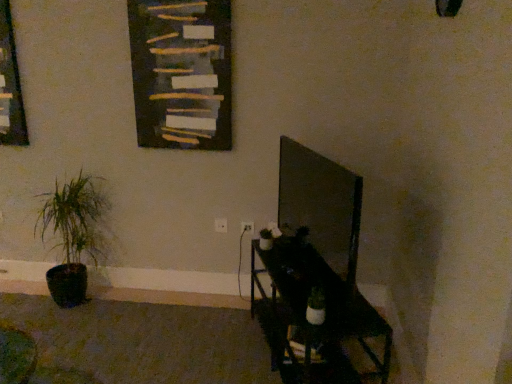
Where is `green matte plant at left`? green matte plant at left is located at coordinates pos(73,235).

Based on the photo, what is the approximate width of metallic black shelf at lower right?

metallic black shelf at lower right is 15.43 inches wide.

The height and width of the screenshot is (384, 512). In order to click on metallic black shelf at lower right in this screenshot , I will do `click(306, 304)`.

Locate an element on the screen. This screenshot has height=384, width=512. green matte plant at left is located at coordinates (73, 235).

Measure the distance between dark wood bulletin board at upper center and green matte plant at left.

dark wood bulletin board at upper center and green matte plant at left are 90.29 centimeters apart from each other.

This screenshot has width=512, height=384. Identify the location of bulletin board in front of the green matte plant at left. (182, 73).

From a real-world perspective, relative to green matte plant at left, is dark wood bulletin board at upper center vertically above or below?

In terms of real-world spatial position, dark wood bulletin board at upper center is above green matte plant at left.

Which of these two, dark wood bulletin board at upper center or green matte plant at left, stands taller?

green matte plant at left is taller.

Considering the positions of points (143, 60) and (275, 278), is point (143, 60) farther from camera compared to point (275, 278)?

That is True.

Considering the relative positions of dark wood bulletin board at upper center and metallic black shelf at lower right in the image provided, is dark wood bulletin board at upper center to the left or to the right of metallic black shelf at lower right?

Clearly, dark wood bulletin board at upper center is on the left of metallic black shelf at lower right in the image.

Considering the sizes of objects dark wood bulletin board at upper center and metallic black shelf at lower right in the image provided, who is smaller, dark wood bulletin board at upper center or metallic black shelf at lower right?

dark wood bulletin board at upper center is smaller.

Between dark wood bulletin board at upper center and metallic black shelf at lower right, which one has larger width?

metallic black shelf at lower right.

From the image's perspective, is metallic black shelf at lower right located beneath wooden frame at left?

Result: Yes.

Is there a large distance between metallic black shelf at lower right and wooden frame at left?

That's right, there is a large distance between metallic black shelf at lower right and wooden frame at left.

Is metallic black shelf at lower right positioned behind wooden frame at left?

No, it is in front of wooden frame at left.

In the scene shown: Between metallic black shelf at lower right and wooden frame at left, which one appears on the right side from the viewer's perspective?

Positioned to the right is metallic black shelf at lower right.

From the image's perspective, is green matte plant at left above or below metallic black shelf at lower right?

Clearly, from the image's perspective, green matte plant at left is above metallic black shelf at lower right.

Does green matte plant at left turn towards metallic black shelf at lower right?

No, green matte plant at left is not oriented towards metallic black shelf at lower right.

Between point (98, 200) and point (337, 292), which one is positioned in front?

The point (337, 292) is in front.

Is wooden frame at left oriented away from green matte plant at left?

No.

Which object is further away from the camera, wooden frame at left or green matte plant at left?

wooden frame at left.

Is wooden frame at left shorter than green matte plant at left?

Yes.

Is wooden frame at left far from green matte plant at left?

No, wooden frame at left is not far from green matte plant at left.

Which object is closer to the camera, green matte plant at left or wooden frame at left?

green matte plant at left.

Where is `houseplant below the wooden frame at left (from a real-world perspective)`? The width and height of the screenshot is (512, 384). houseplant below the wooden frame at left (from a real-world perspective) is located at coordinates (73, 235).

From a real-world perspective, is green matte plant at left positioned under wooden frame at left based on gravity?

Indeed, from a real-world perspective, green matte plant at left is positioned beneath wooden frame at left.

From the image's perspective, is green matte plant at left positioned above or below wooden frame at left?

Based on their image positions, green matte plant at left is located beneath wooden frame at left.

Can you confirm if wooden frame at left is shorter than metallic black shelf at lower right?

In fact, wooden frame at left may be taller than metallic black shelf at lower right.

How far apart are wooden frame at left and metallic black shelf at lower right?

wooden frame at left and metallic black shelf at lower right are 6.88 feet apart.

Does wooden frame at left lie in front of metallic black shelf at lower right?

No, it is behind metallic black shelf at lower right.

Looking at the image, does wooden frame at left seem bigger or smaller compared to metallic black shelf at lower right?

In the image, wooden frame at left appears to be smaller than metallic black shelf at lower right.

Image resolution: width=512 pixels, height=384 pixels. Identify the location of houseplant below the dark wood bulletin board at upper center (from a real-world perspective). (73, 235).

Find the location of a particular element. The width and height of the screenshot is (512, 384). furniture on the right of dark wood bulletin board at upper center is located at coordinates (306, 304).

Considering their positions, is wooden frame at left positioned further to green matte plant at left than metallic black shelf at lower right?

Among the two, metallic black shelf at lower right is located further to green matte plant at left.

Looking at the image, which one is located closer to metallic black shelf at lower right, green matte plant at left or wooden frame at left?

green matte plant at left is positioned closer to the anchor metallic black shelf at lower right.

Based on their spatial positions, is dark wood bulletin board at upper center or green matte plant at left closer to wooden frame at left?

Answer: green matte plant at left is closer to wooden frame at left.

Estimate the real-world distances between objects in this image. Which object is closer to metallic black shelf at lower right, green matte plant at left or dark wood bulletin board at upper center?

dark wood bulletin board at upper center is positioned closer to the anchor metallic black shelf at lower right.

Looking at the image, which one is located further to metallic black shelf at lower right, wooden frame at left or dark wood bulletin board at upper center?

wooden frame at left.

Estimate the real-world distances between objects in this image. Which object is closer to dark wood bulletin board at upper center, wooden frame at left or green matte plant at left?

The object closer to dark wood bulletin board at upper center is green matte plant at left.

When comparing their distances from green matte plant at left, does metallic black shelf at lower right or dark wood bulletin board at upper center seem further?

metallic black shelf at lower right is positioned further to the anchor green matte plant at left.

Considering their positions, is dark wood bulletin board at upper center positioned further to green matte plant at left than wooden frame at left?

The object further to green matte plant at left is dark wood bulletin board at upper center.

The width and height of the screenshot is (512, 384). I want to click on bulletin board between wooden frame at left and metallic black shelf at lower right, so click(x=182, y=73).

Locate an element on the screen. The width and height of the screenshot is (512, 384). bulletin board between green matte plant at left and metallic black shelf at lower right from left to right is located at coordinates (182, 73).

Where is `houseplant situated between wooden frame at left and dark wood bulletin board at upper center from left to right`? This screenshot has width=512, height=384. houseplant situated between wooden frame at left and dark wood bulletin board at upper center from left to right is located at coordinates (73, 235).

The width and height of the screenshot is (512, 384). I want to click on houseplant between wooden frame at left and metallic black shelf at lower right, so click(73, 235).